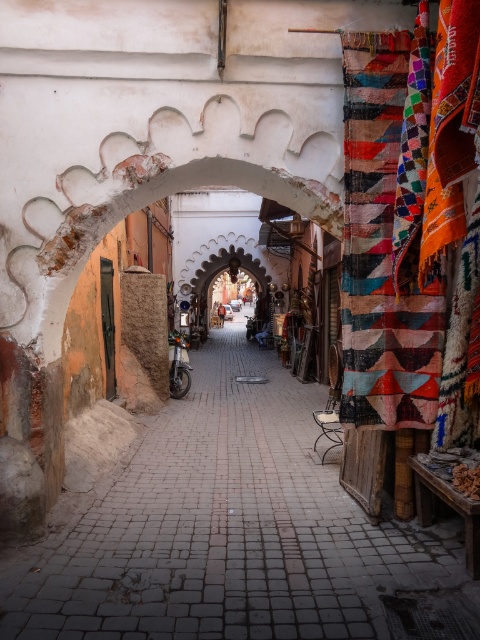
You are a delivery person with a 1.5 meter long box that needs to be carried through the alleyway. The box must be carried horizontally. Given the space between the multicolored woven rug at right and the silver metallic motorcycle at center, will the box fit through? Please explain your reasoning.

The multicolored woven rug at right is bigger than the silver metallic motorcycle at center. However, the exact dimensions of the space between them are not provided. Since the box is 1.5 meters long and must be carried horizontally, it is uncertain whether the available space is sufficient. More information about the specific width or distance between the two objects is needed to determine if the box will fit.

From the picture: You are a tourist carrying a backpack and want to take a photo of the multicolored woven rug at right. If your camera has a maximum focus range of 3 meters, will you need to move closer to take a clear photo?

The multicolored woven rug at right is 3.28 meters away from the camera. Since the camera can only focus up to 3 meters, you need to move closer to ensure the photo is clear.